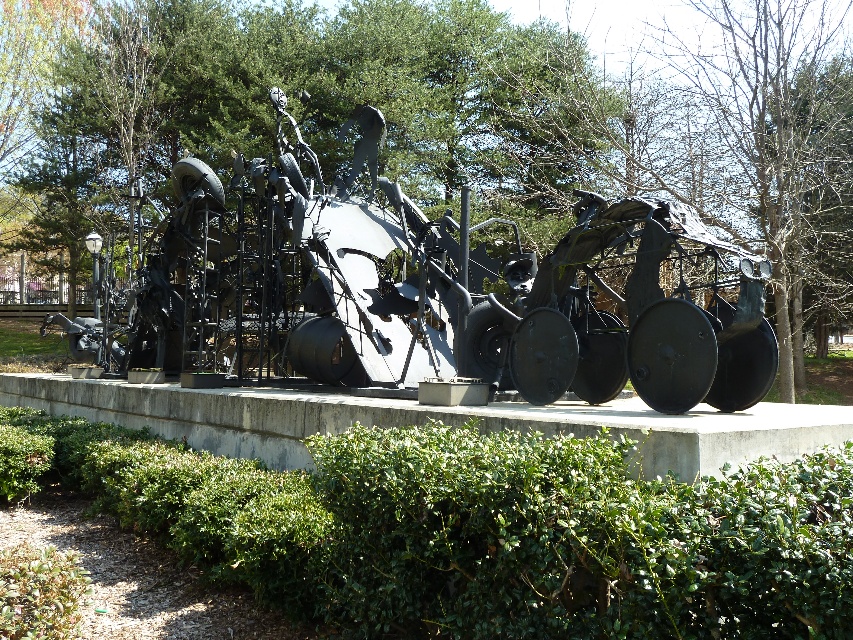
Describe the element at coordinates (482, 531) in the screenshot. I see `green leafy hedge at center` at that location.

Is green leafy hedge at center bigger than black metal sculpture at center?

Incorrect, green leafy hedge at center is not larger than black metal sculpture at center.

You are a GUI agent. You are given a task and a screenshot of the screen. Output one action in this format:
    pyautogui.click(x=<x>, y=<y>)
    Task: Click on the green leafy hedge at center
    The height and width of the screenshot is (640, 853).
    Given the screenshot: What is the action you would take?
    pyautogui.click(x=482, y=531)